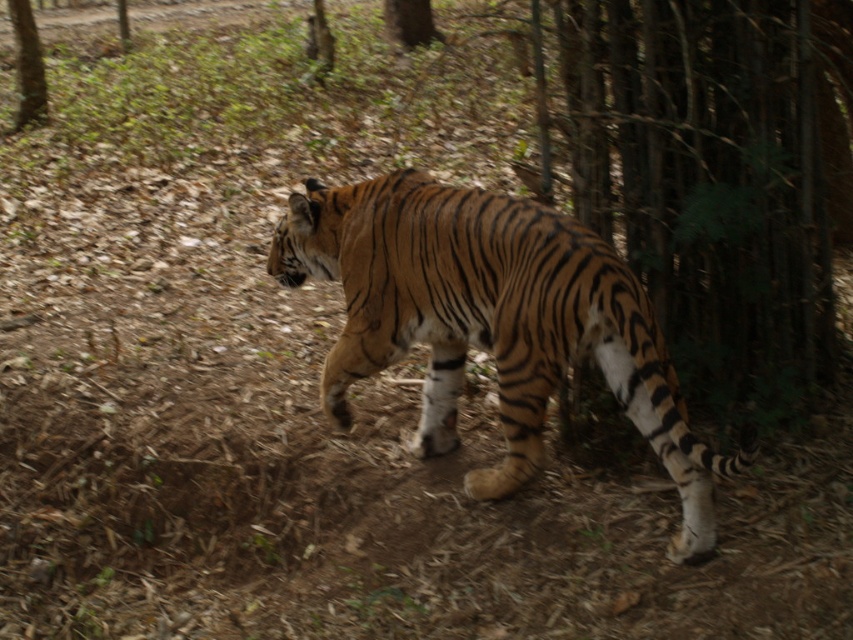
Question: Which object is farther from the camera taking this photo?

Choices:
 (A) orange-brown striped tiger at center
 (B) brown textured tree at upper left

Answer: (B)

Question: Which point appears closest to the camera in this image?

Choices:
 (A) (21, 20)
 (B) (486, 268)

Answer: (B)

Question: In this image, where is orange-brown striped tiger at center located relative to brown textured tree at upper left?

Choices:
 (A) right
 (B) left

Answer: (A)

Question: Does orange-brown striped tiger at center have a lesser width compared to brown textured tree at upper left?

Choices:
 (A) yes
 (B) no

Answer: (B)

Question: Is orange-brown striped tiger at center closer to the viewer compared to brown textured tree at upper left?

Choices:
 (A) yes
 (B) no

Answer: (A)